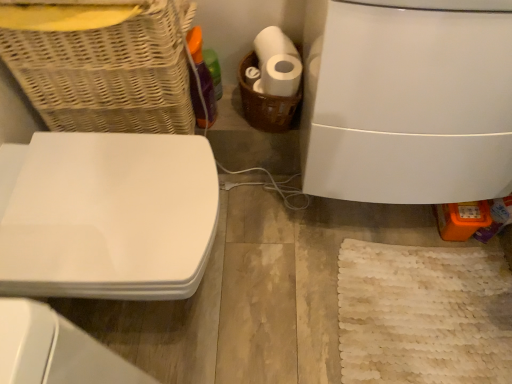
Question: Is white glossy toilet at right shorter than woven wicker basket at upper left, placed as the 1th basket when sorted from left to right?

Choices:
 (A) yes
 (B) no

Answer: (B)

Question: Does white glossy toilet at right have a lesser width compared to woven wicker basket at upper left, placed as the 1th basket when sorted from left to right?

Choices:
 (A) yes
 (B) no

Answer: (B)

Question: Is white glossy toilet at right outside of woven wicker basket at upper left, which is counted as the second basket, starting from the right?

Choices:
 (A) no
 (B) yes

Answer: (B)

Question: From the image's perspective, is white glossy toilet at right beneath woven wicker basket at upper left, which is counted as the second basket, starting from the right?

Choices:
 (A) yes
 (B) no

Answer: (A)

Question: Could woven wicker basket at upper left, placed as the 1th basket when sorted from left to right, be considered to be inside white glossy toilet at right?

Choices:
 (A) yes
 (B) no

Answer: (B)

Question: Can you confirm if white glossy toilet at right is wider than woven wicker basket at upper left, which is counted as the second basket, starting from the right?

Choices:
 (A) yes
 (B) no

Answer: (A)

Question: Can you confirm if brown woven basket at center, which is the second basket in left-to-right order, is smaller than white glossy toilet at right?

Choices:
 (A) no
 (B) yes

Answer: (B)

Question: Is brown woven basket at center, which is the second basket in left-to-right order, further to camera compared to white glossy toilet at right?

Choices:
 (A) yes
 (B) no

Answer: (A)

Question: Does brown woven basket at center, which is the second basket in left-to-right order, appear on the right side of white glossy toilet at right?

Choices:
 (A) no
 (B) yes

Answer: (A)

Question: Would you consider brown woven basket at center, which is the second basket in left-to-right order, to be distant from white glossy toilet at right?

Choices:
 (A) no
 (B) yes

Answer: (A)

Question: Does brown woven basket at center, which is the second basket in left-to-right order, have a greater height compared to white glossy toilet at right?

Choices:
 (A) no
 (B) yes

Answer: (A)

Question: From the image's perspective, does brown woven basket at center, positioned as the first basket in right-to-left order, appear higher than white glossy toilet at right?

Choices:
 (A) yes
 (B) no

Answer: (A)

Question: From a real-world perspective, is white glossy toilet seat at left physically below brown woven basket at center, which is the second basket in left-to-right order?

Choices:
 (A) no
 (B) yes

Answer: (B)